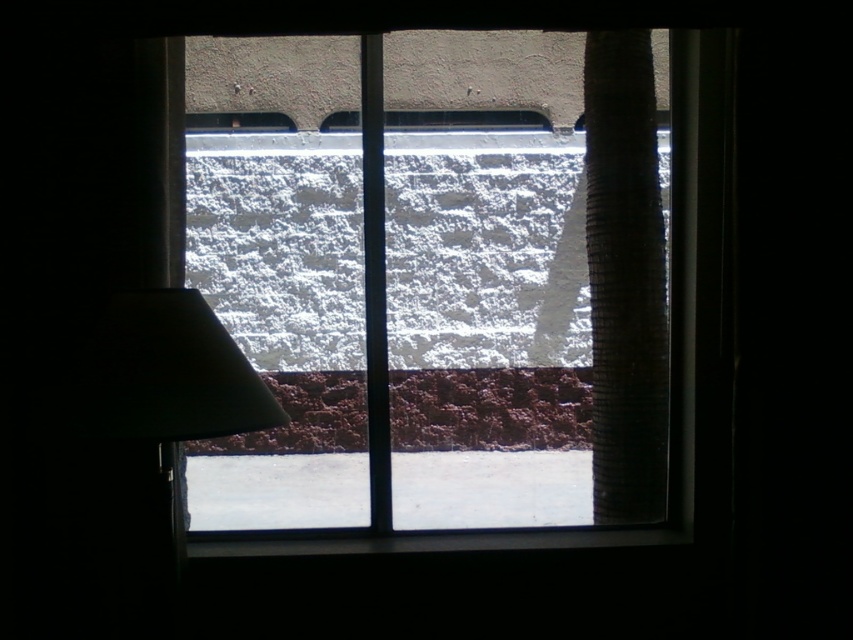
You are a window installer assessing the space. The transparent glass window at center needs to be replaced. Considering the height of the black corrugated pipe at right, will the new window fit without any adjustments?

The transparent glass window at center is much taller than the black corrugated pipe at right, so the new window will need to be adjusted to fit within the space occupied by the black corrugated pipe at right.

You are standing inside the building looking through the window. There are two points marked on the window glass, one at point coordinates point (393,301) and the other at point (618,67). Which point is closer to your eyes?

Point (618,67) is closer to your eyes because it is less further to the camera than point (393,301).

You are a delivery person trying to determine if the black corrugated pipe at right is visible from outside the building through the transparent glass window at center. Can you see it from outside?

The black corrugated pipe at right is behind the transparent glass window at center, so yes, it would be visible from outside through the window.